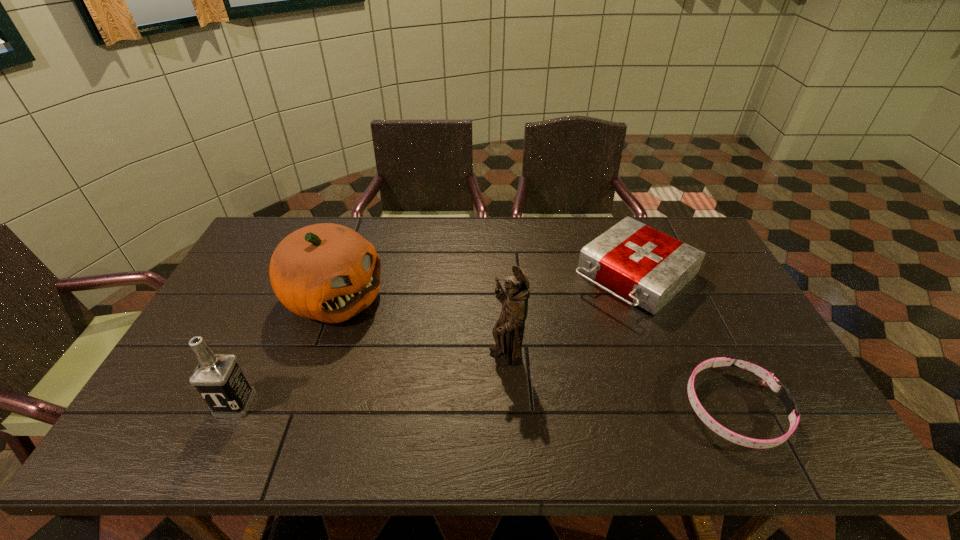
Where is `vacant space on the desktop that is between the vodka and the dog collar and is positioned on the front side of the second shortest object`? vacant space on the desktop that is between the vodka and the dog collar and is positioned on the front side of the second shortest object is located at coordinates (477, 406).

Locate an element on the screen. free space on the desktop that is between the vodka and the dog collar and is positioned on the face of the pumpkin is located at coordinates (548, 407).

Locate an element on the screen. free space on the desktop that is between the vodka and the dog collar and is positioned on the front-facing side of the tallest object is located at coordinates (454, 406).